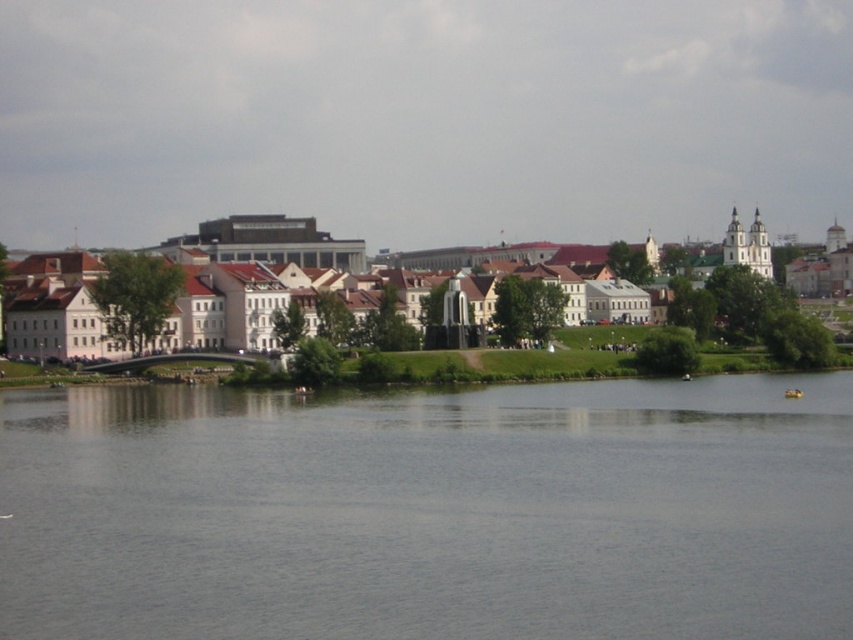
Question: In this image, where is gray smooth water at center located relative to white smooth buildings at center?

Choices:
 (A) right
 (B) left

Answer: (B)

Question: Is gray smooth water at center above white smooth buildings at center?

Choices:
 (A) yes
 (B) no

Answer: (B)

Question: Where is gray smooth water at center located in relation to white smooth buildings at center in the image?

Choices:
 (A) above
 (B) below

Answer: (B)